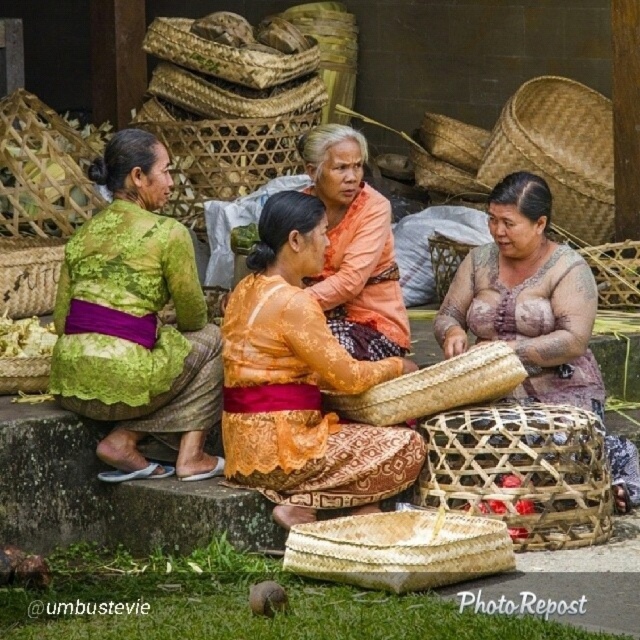
You are a visitor observing the weaving scene and want to place a new basket between the brown textured woven basket at center and the natural woven basket at upper left. Based on their positions, which basket should you place your new basket to the right of?

You should place the new basket to the right of the natural woven basket at upper left because the brown textured woven basket at center is already positioned to its right.

You are a visitor observing the weaving scene. You notice the brown textured woven basket at center and the natural woven basket at upper left. Which basket is positioned lower in the image?

The brown textured woven basket at center is positioned lower than the natural woven basket at upper left.